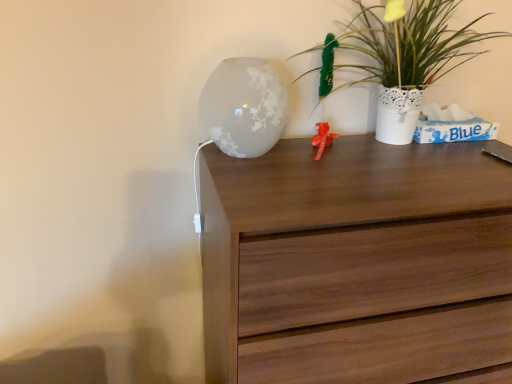
Question: Does point (263, 104) appear closer or farther from the camera than point (382, 228)?

Choices:
 (A) closer
 (B) farther

Answer: (B)

Question: Is frosted glass vase at upper center in front of or behind walnut wood chest of drawers at center in the image?

Choices:
 (A) behind
 (B) front

Answer: (A)

Question: Estimate the real-world distances between objects in this image. Which object is closer to the walnut wood chest of drawers at center?

Choices:
 (A) white textured vase at upper right
 (B) frosted glass vase at upper center

Answer: (B)

Question: Which is nearer to the white textured vase at upper right?

Choices:
 (A) walnut wood chest of drawers at center
 (B) frosted glass vase at upper center

Answer: (A)